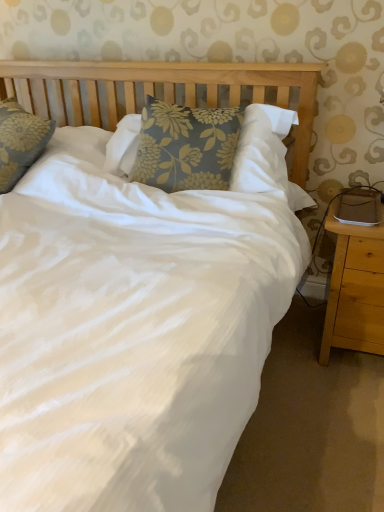
Question: From the image's perspective, is blue floral pillow at center located above or below light brown wood nightstand at lower right?

Choices:
 (A) below
 (B) above

Answer: (B)

Question: From their relative heights in the image, would you say blue floral pillow at center is taller or shorter than light brown wood nightstand at lower right?

Choices:
 (A) short
 (B) tall

Answer: (A)

Question: In the image, is blue floral pillow at center positioned in front of or behind light brown wood nightstand at lower right?

Choices:
 (A) front
 (B) behind

Answer: (B)

Question: From the image's perspective, is light brown wood nightstand at lower right above or below blue floral pillow at center?

Choices:
 (A) below
 (B) above

Answer: (A)

Question: In terms of width, does light brown wood nightstand at lower right look wider or thinner when compared to blue floral pillow at center?

Choices:
 (A) thin
 (B) wide

Answer: (B)

Question: Visually, is light brown wood nightstand at lower right positioned to the left or to the right of blue floral pillow at center?

Choices:
 (A) right
 (B) left

Answer: (A)

Question: Looking at the image, does light brown wood nightstand at lower right seem bigger or smaller compared to blue floral pillow at center?

Choices:
 (A) big
 (B) small

Answer: (B)